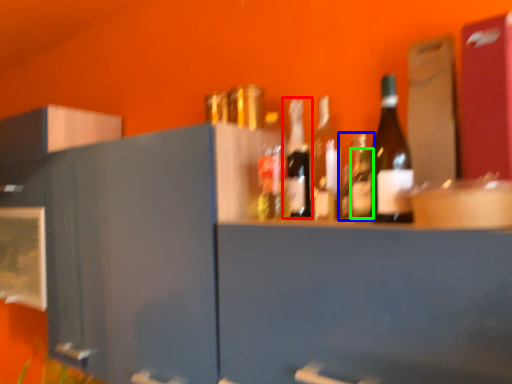
Question: Based on their relative distances, which object is nearer to bottle (highlighted by a red box)? Choose from bottle (highlighted by a blue box) and bottle (highlighted by a green box).

Choices:
 (A) bottle
 (B) bottle

Answer: (A)